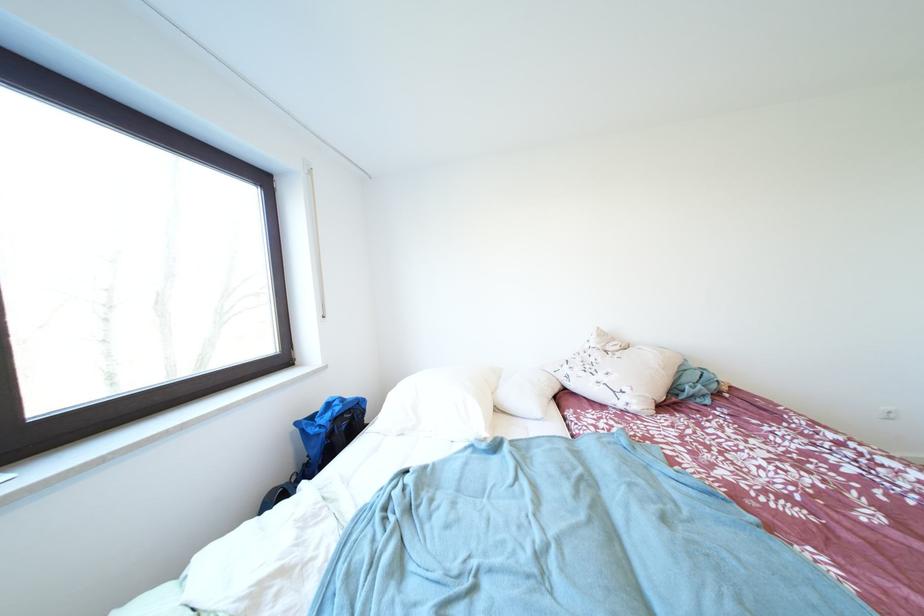
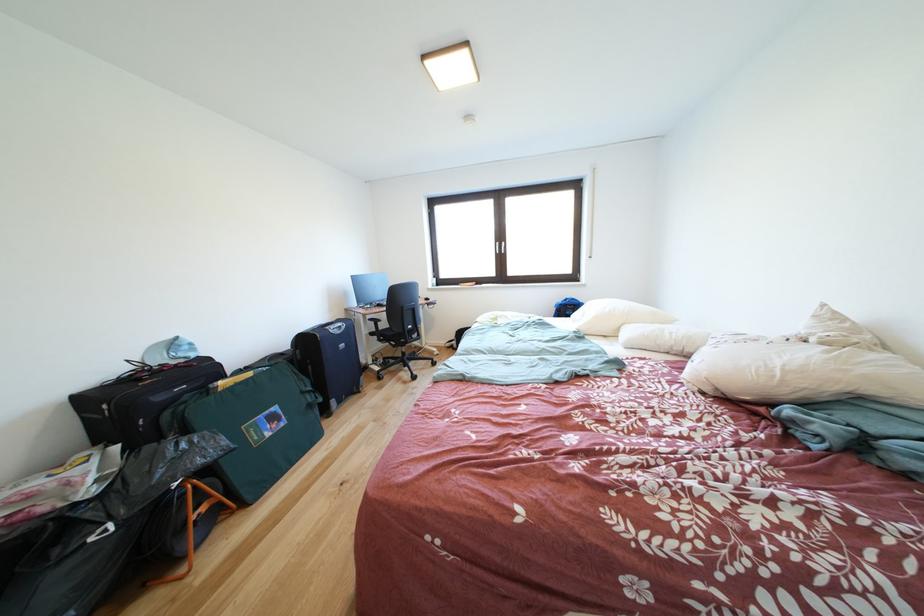
The point at (357, 416) is marked in the first image. Where is the corresponding point in the second image?

(578, 310)